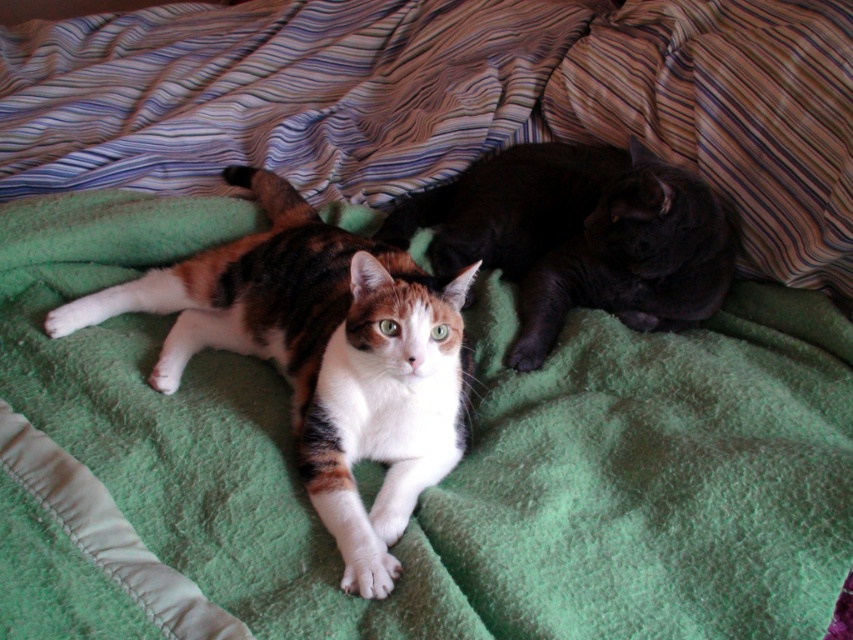
Based on the photo, you are an automated pet feeder that needs to deliver food to the calico fur cat at center. The feeder is located at point 0.5, 0.5. Based on their 2D coordinates, will the feeder need to move left or right to reach the cat?

The calico fur cat at center is located at coordinates (322, 356). Since the feeder is at (426, 320), it needs to move to the right along the x axis to reach the cat.